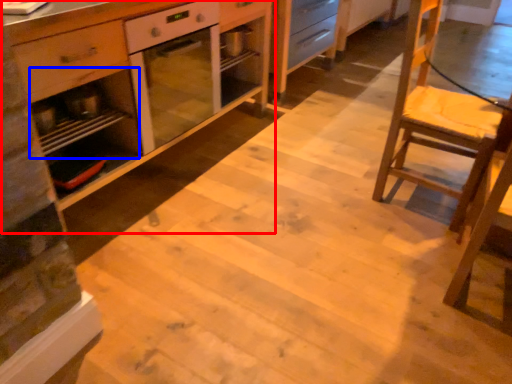
Question: Which object is closer to the camera taking this photo, cabinetry (highlighted by a red box) or shelf (highlighted by a blue box)?

Choices:
 (A) cabinetry
 (B) shelf

Answer: (A)